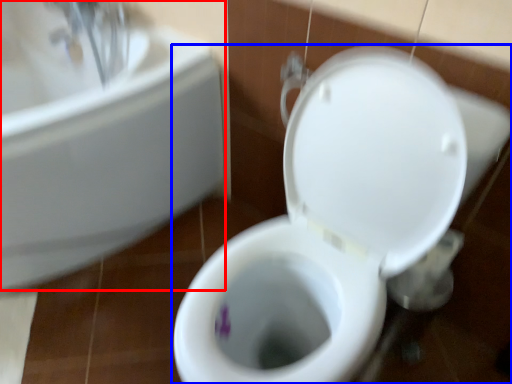
Question: Which object appears closest to the camera in this image, sink (highlighted by a red box) or toilet (highlighted by a blue box)?

Choices:
 (A) sink
 (B) toilet

Answer: (B)